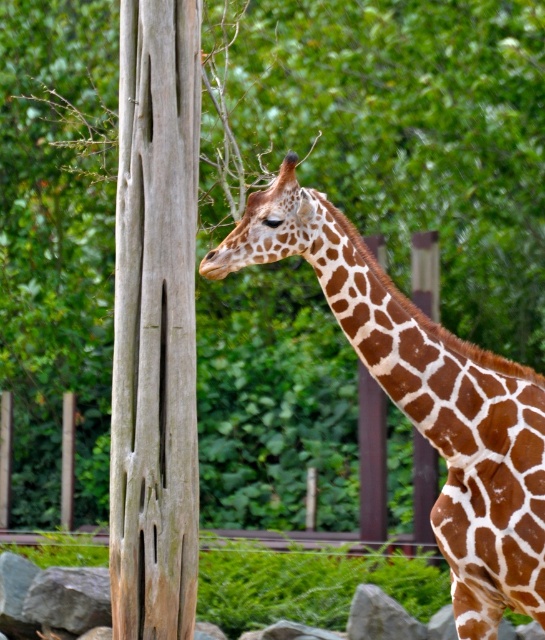
Looking at this image, between weathered wood tree trunk at left and brown spotted giraffe at center, which one appears on the left side from the viewer's perspective?

weathered wood tree trunk at left

Is weathered wood tree trunk at left wider than brown spotted giraffe at center?

No.

The height and width of the screenshot is (640, 545). In order to click on weathered wood tree trunk at left in this screenshot , I will do `click(155, 323)`.